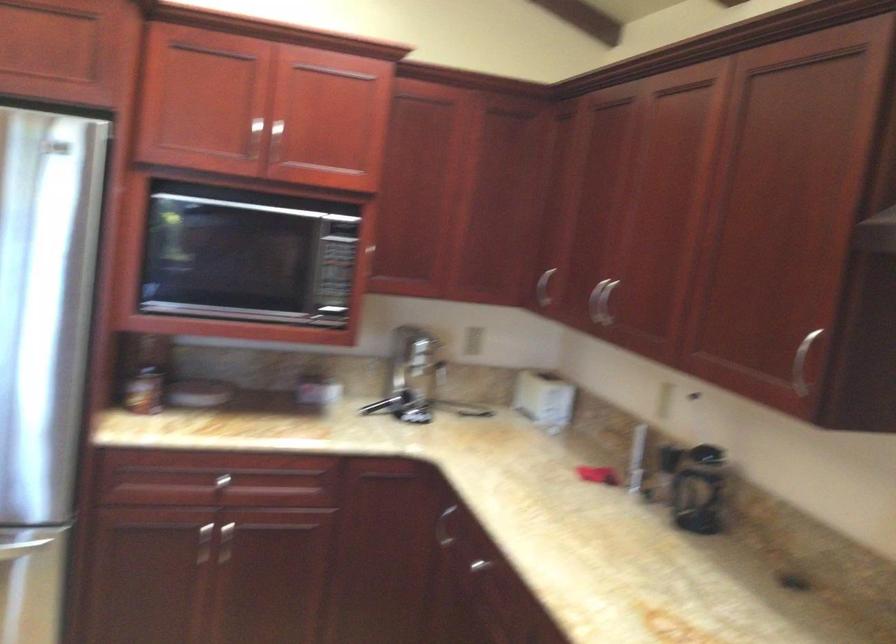
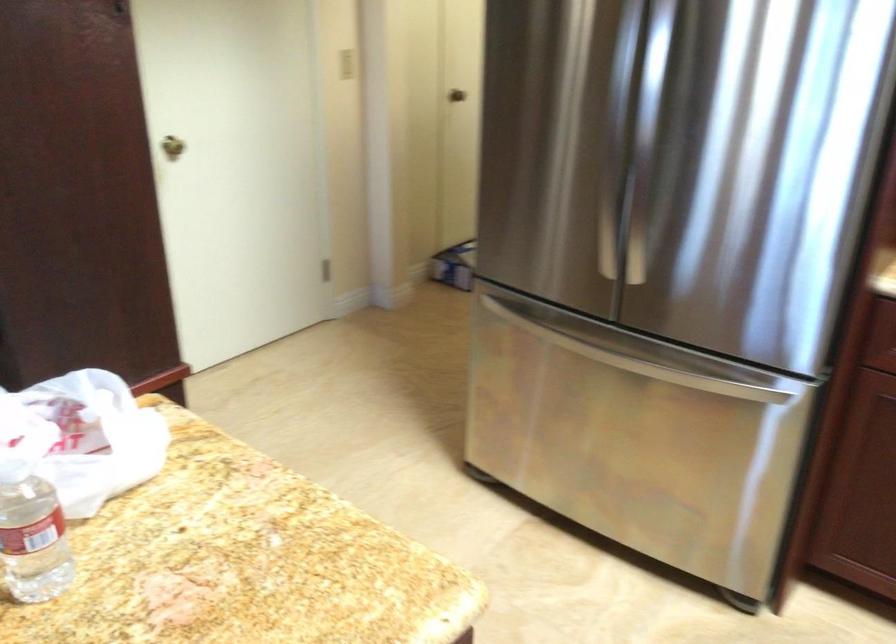
Question: The camera is either moving clockwise (left) or counter-clockwise (right) around the object. The first image is from the beginning of the video and the second image is from the end. Is the camera moving left or right when shooting the video?

Choices:
 (A) Left
 (B) Right

Answer: (B)